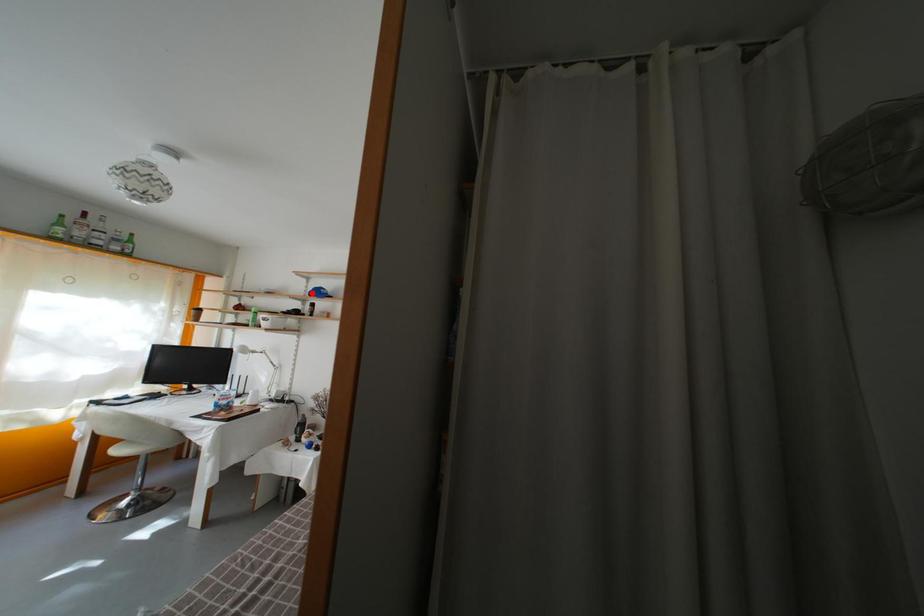
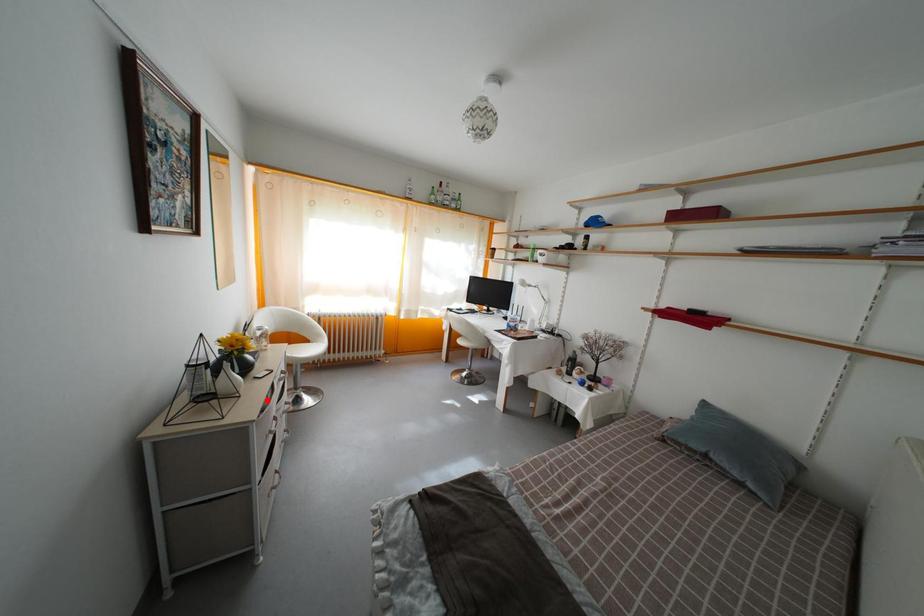
I am providing you with two images of the same scene from different viewpoints. A red point is marked on the first image and another point is marked on the second image. Are the points marked in image1 and image2 representing the same 3D position?

No